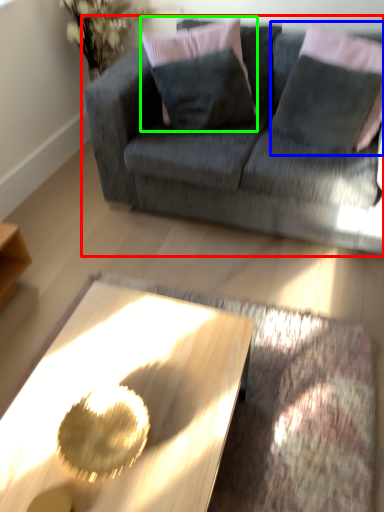
Question: Which object is the closest to the studio couch (highlighted by a red box)? Choose among these: pillow (highlighted by a blue box) or pillow (highlighted by a green box).

Choices:
 (A) pillow
 (B) pillow

Answer: (B)